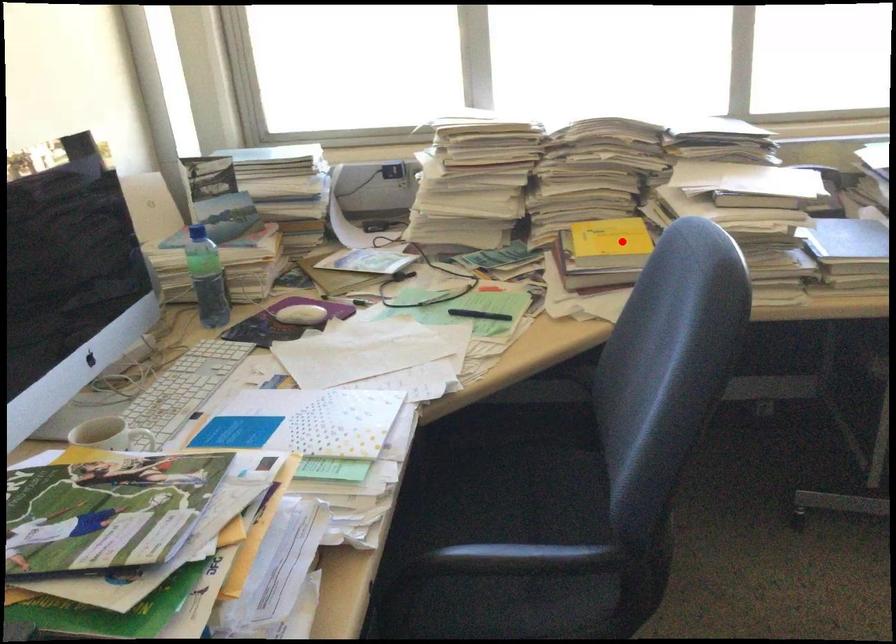
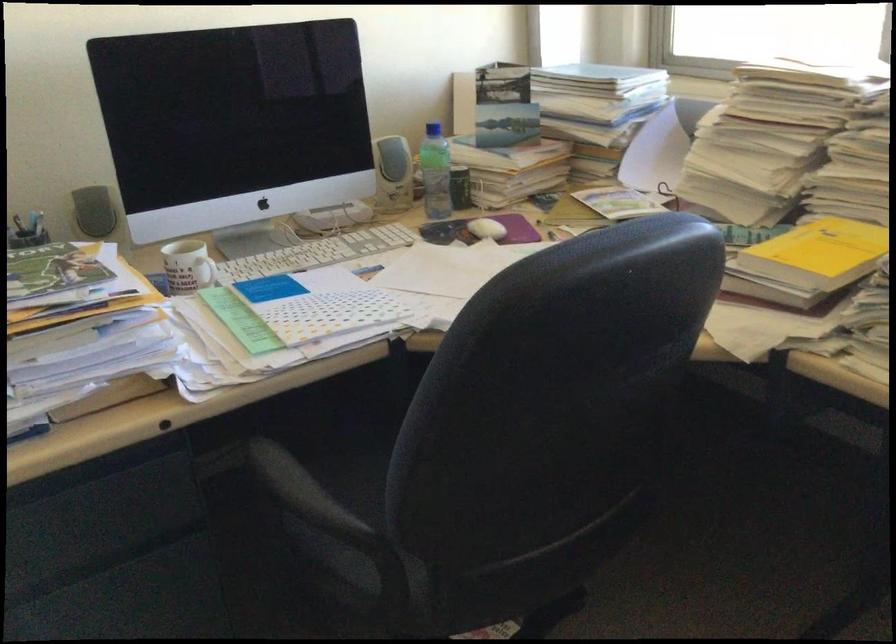
Question: A red point is marked in image1. In image2, is the corresponding 3D point closer to the camera or farther? Reply with the corresponding letter.

Choices:
 (A) The corresponding 3D point is closer.
 (B) The corresponding 3D point is farther.

Answer: (A)